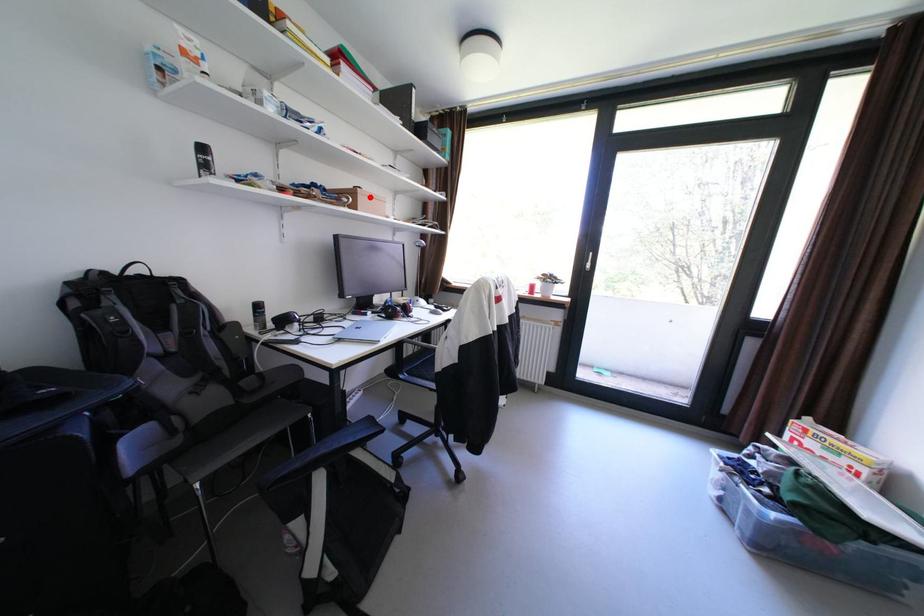
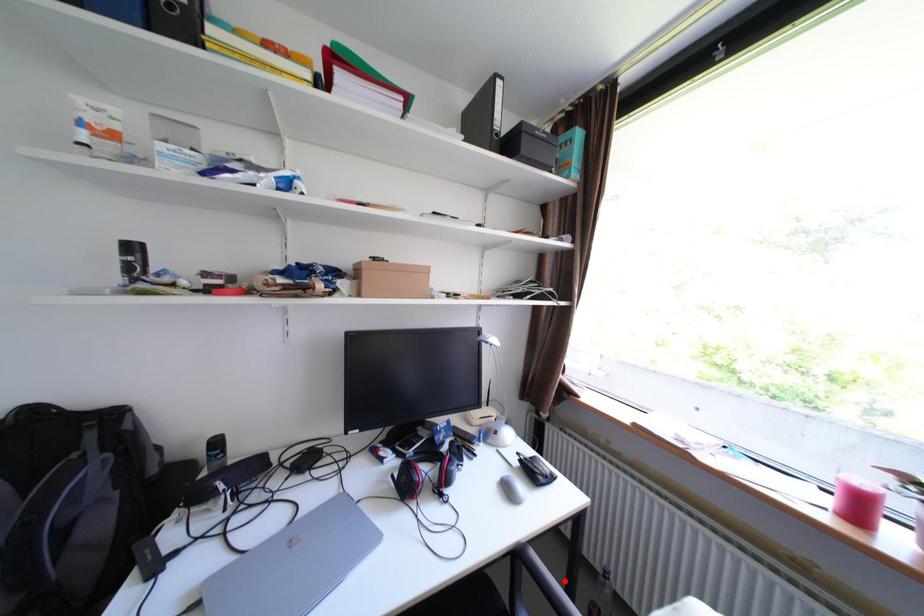
I am providing you with two images of the same scene from different viewpoints. A red point is marked on the first image and another point is marked on the second image. Do the highlighted points in image1 and image2 indicate the same real-world spot?

No